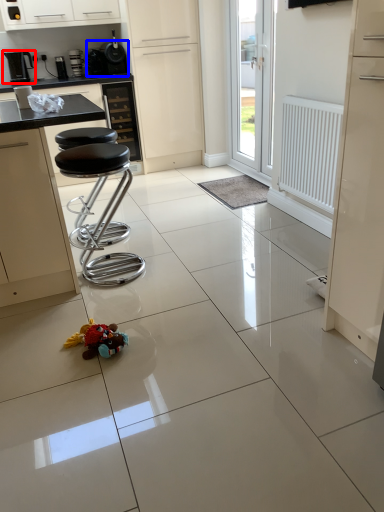
Question: Which point is further to the camera, coffee machine (highlighted by a red box) or appliance (highlighted by a blue box)?

Choices:
 (A) coffee machine
 (B) appliance

Answer: (A)